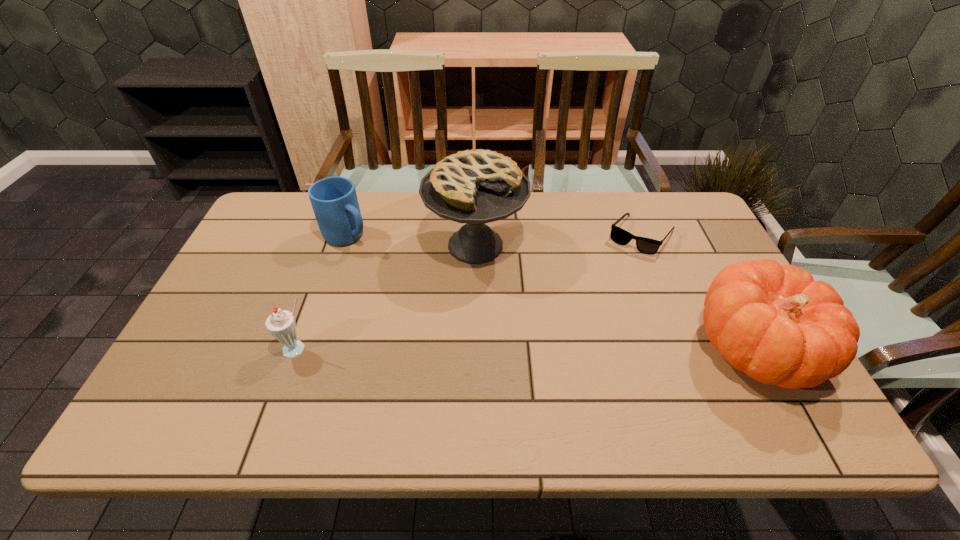
The height and width of the screenshot is (540, 960). I want to click on milkshake, so click(281, 324).

Find the location of `pumpkin`. pumpkin is located at coordinates (773, 322).

Locate an element on the screen. The height and width of the screenshot is (540, 960). the tallest object is located at coordinates (479, 186).

Locate an element on the screen. The width and height of the screenshot is (960, 540). the third object from right to left is located at coordinates (479, 186).

Where is `the shortest object`? The image size is (960, 540). the shortest object is located at coordinates (618, 235).

Where is `mug`? This screenshot has width=960, height=540. mug is located at coordinates (334, 200).

The height and width of the screenshot is (540, 960). Find the location of `vacant area situated on the straw side of the milkshake`. vacant area situated on the straw side of the milkshake is located at coordinates (282, 394).

Locate an element on the screen. Image resolution: width=960 pixels, height=540 pixels. vacant space located 0.190m on the back of the second tallest object is located at coordinates (703, 254).

Find the location of a particular element. The image size is (960, 540). free location located on the cut side of the tallest object is located at coordinates (505, 372).

Identify the location of free space located 0.220m on the cut side of the tallest object. (498, 344).